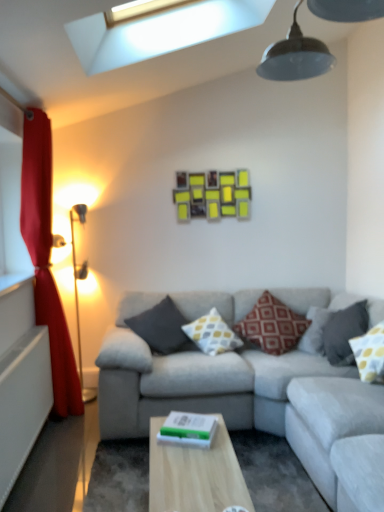
Find the location of a particular element. The width and height of the screenshot is (384, 512). empty space that is ontop of light wood table at center is located at coordinates (208, 467).